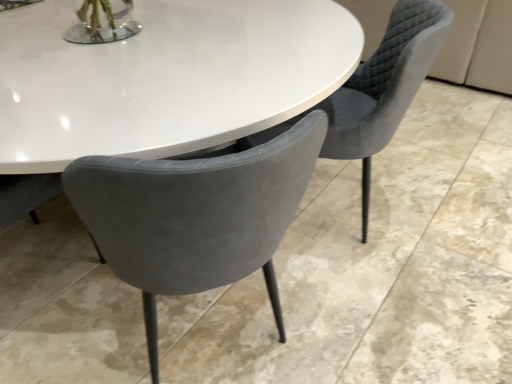
This screenshot has height=384, width=512. I want to click on vacant area situated below velvet grey chair at center, arranged as the 2th chair when viewed from the left (from a real-world perspective), so click(x=337, y=208).